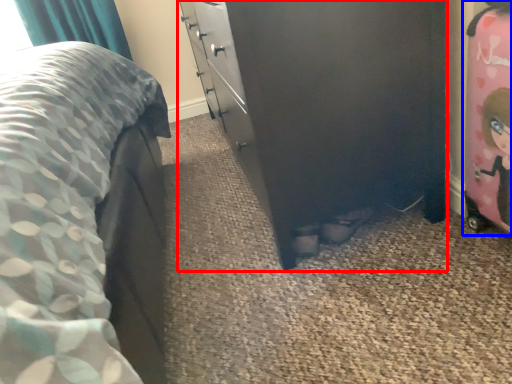
Question: Which object appears closest to the camera in this image, chest of drawers (highlighted by a red box) or toy (highlighted by a blue box)?

Choices:
 (A) chest of drawers
 (B) toy

Answer: (B)